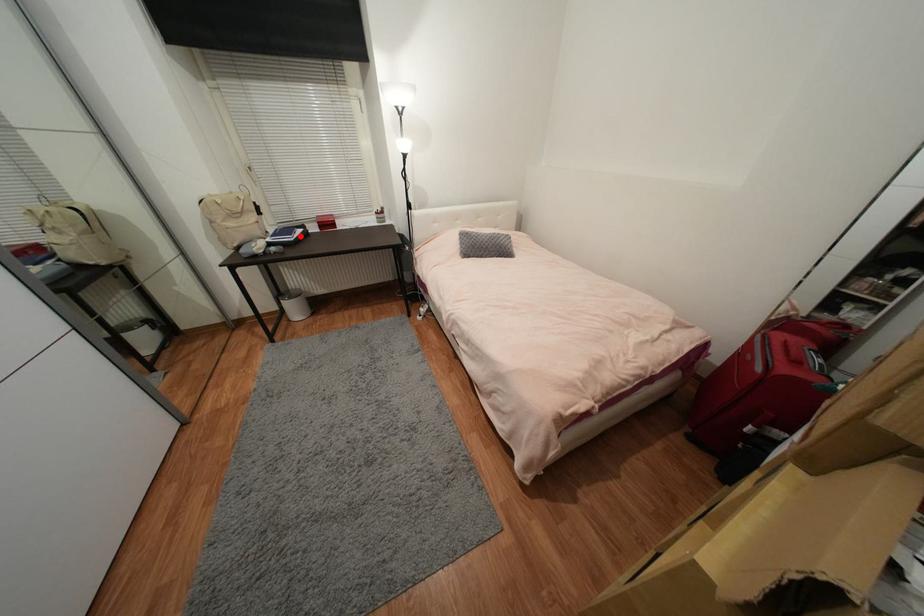
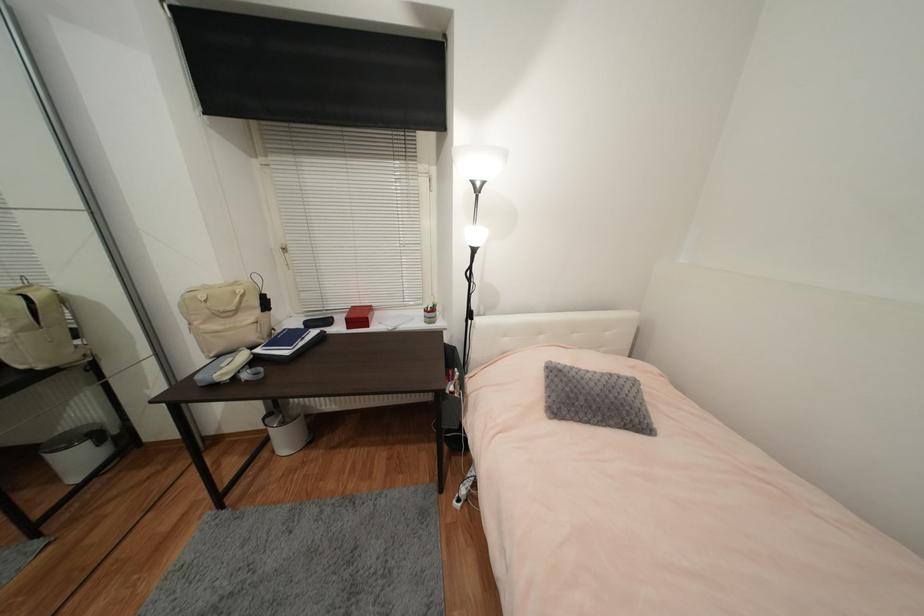
Question: I am providing you with two images of the same scene from different viewpoints. A red point is marked on the first image. At the location where the point appears in image 1, is it still visible in image 2?

Choices:
 (A) Yes
 (B) No

Answer: (A)